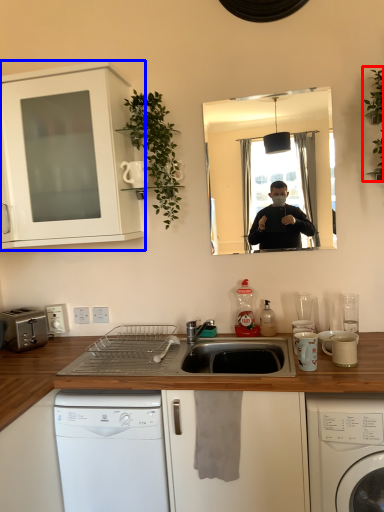
Question: Among these objects, which one is farthest to the camera, plant (highlighted by a red box) or cabinetry (highlighted by a blue box)?

Choices:
 (A) plant
 (B) cabinetry

Answer: (B)